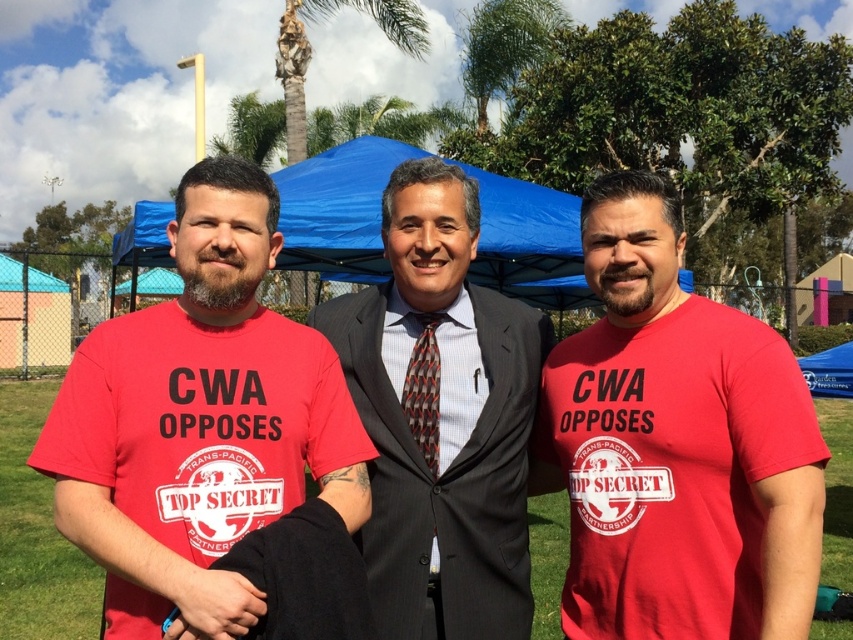
You are standing at the origin point in the image. Which of the two points, point [582,227] or point [552,237], is closer to you?

Point [582,227] is in front of point [552,237], so it is closer to you.